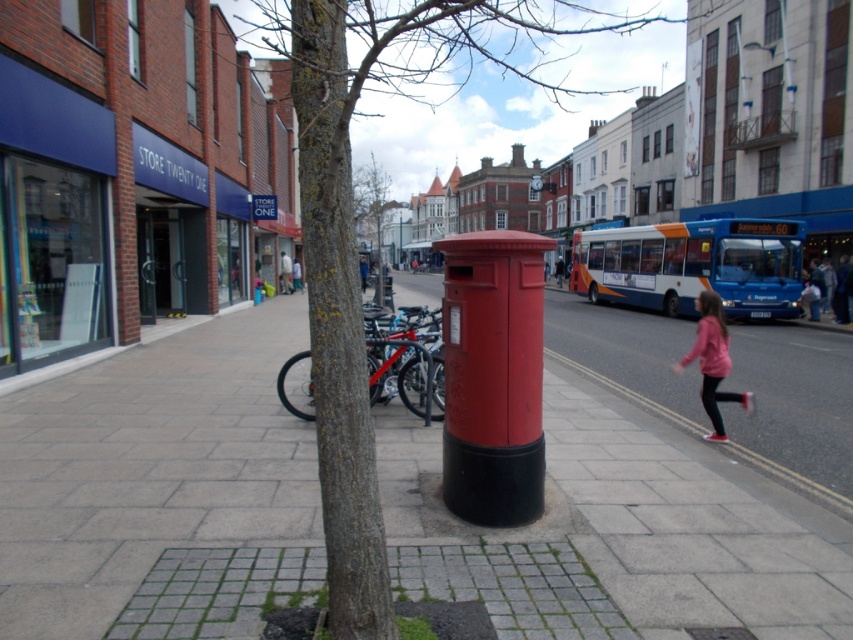
You are a pedestrian standing on the sidewalk and see the blue metallic bus at center and the white cotton jacket at center. Which object is closer to you?

The white cotton jacket at center is closer to you because it is smaller in size compared to the blue metallic bus at center, which is larger and likely farther away.

You are a pedestrian standing on the sidewalk. You see a blue metallic bus at center and a white cotton jacket at center. Which object is wider?

The blue metallic bus at center is wider than the white cotton jacket at center.

In the scene shown: What is located at the coordinates point (712, 362)?

The coordinates point (712, 362) mark the location of the pink fabric girl at lower right.